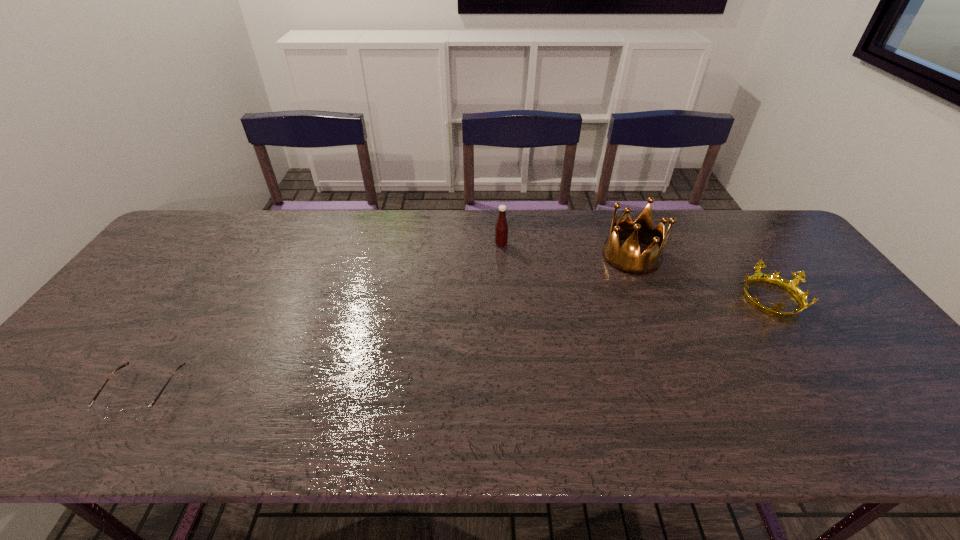
Find the location of a particular element. This screenshot has width=960, height=540. object that stands as the closest to the second object from left to right is located at coordinates [x=627, y=259].

Identify the location of free space that satisfies the following two spatial constraints: 1. on the front side of the second nearest object; 2. on the left side of the taller crown. This screenshot has width=960, height=540. (x=649, y=298).